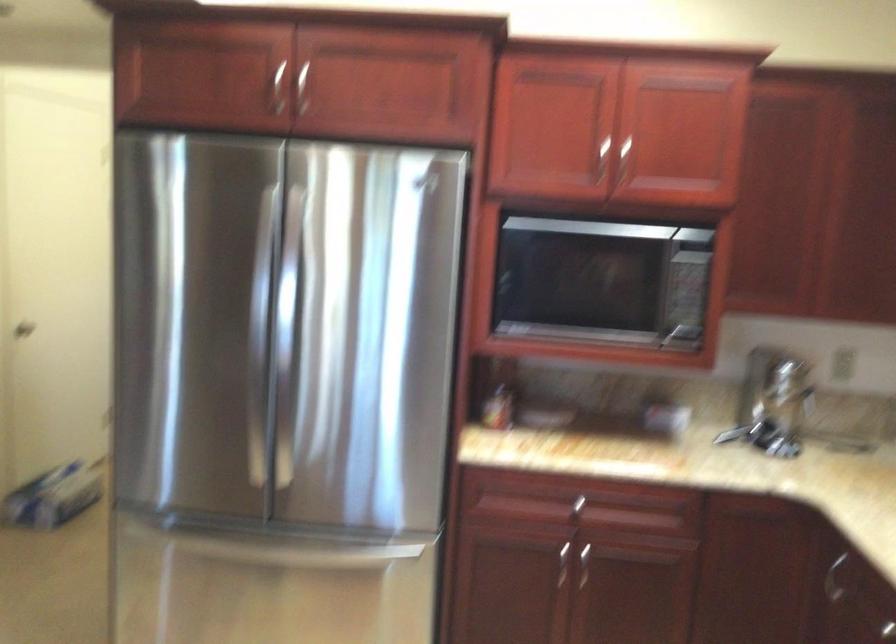
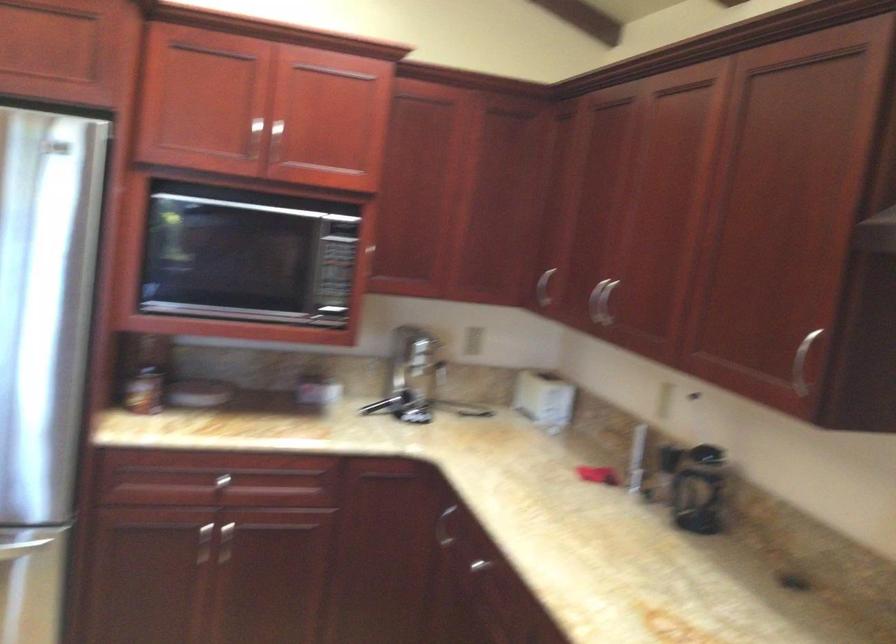
Locate, in the second image, the point that corresponds to point 547,415 in the first image.

(197, 393)